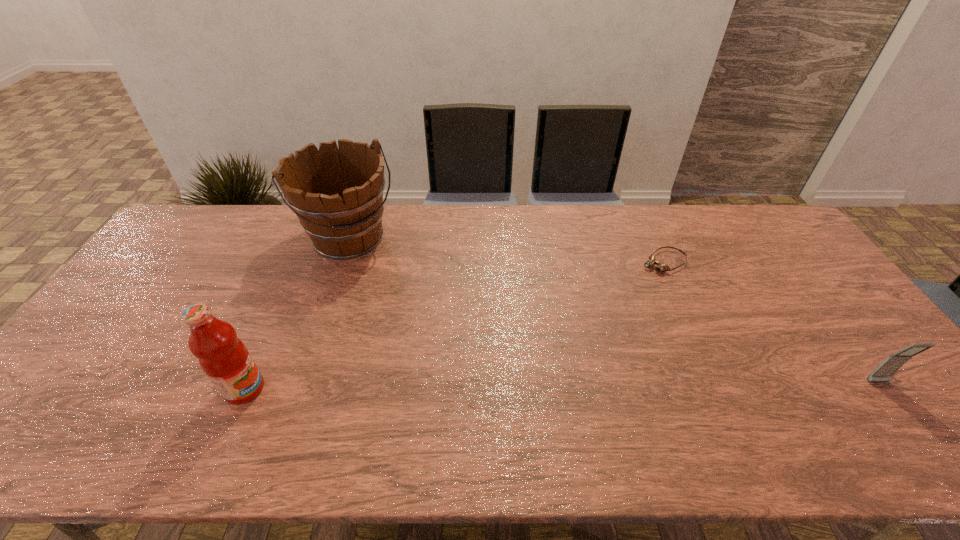
Find the location of a particular element. Image resolution: width=960 pixels, height=540 pixels. fruit juice is located at coordinates (224, 358).

You are a GUI agent. You are given a task and a screenshot of the screen. Output one action in this format:
    pyautogui.click(x=<x>, y=<y>)
    Task: Click on the rightmost object
    
    Given the screenshot: What is the action you would take?
    pyautogui.click(x=883, y=373)

At what (x,y) coordinates should I click in order to perform the action: click on the third tallest object. Please return your answer as a coordinate pair (x, y). This screenshot has height=540, width=960. Looking at the image, I should click on (883, 373).

Where is `the second object from right to left`? the second object from right to left is located at coordinates (659, 268).

You are a GUI agent. You are given a task and a screenshot of the screen. Output one action in this format:
    pyautogui.click(x=<x>, y=<y>)
    Task: Click on the goggles
    The height and width of the screenshot is (540, 960).
    Given the screenshot: What is the action you would take?
    pyautogui.click(x=659, y=268)

Identify the location of wine bucket. This screenshot has height=540, width=960. (337, 194).

At what (x,y) coordinates should I click in order to perform the action: click on blank space located 0.330m on the front label of the fruit juice. Please return your answer as a coordinate pair (x, y). Looking at the image, I should click on (399, 389).

You are a GUI agent. You are given a task and a screenshot of the screen. Output one action in this format:
    pyautogui.click(x=<x>, y=<y>)
    Task: Click on the vacant space situated on the front lenses and sides of the shortest object
    This screenshot has height=540, width=960.
    Given the screenshot: What is the action you would take?
    pyautogui.click(x=621, y=287)

Where is `vacant space situated 0.400m on the front lenses and sides of the shortest object`? vacant space situated 0.400m on the front lenses and sides of the shortest object is located at coordinates (556, 329).

The height and width of the screenshot is (540, 960). Identify the location of vacant position located 0.140m on the front lenses and sides of the shortest object. (618, 289).